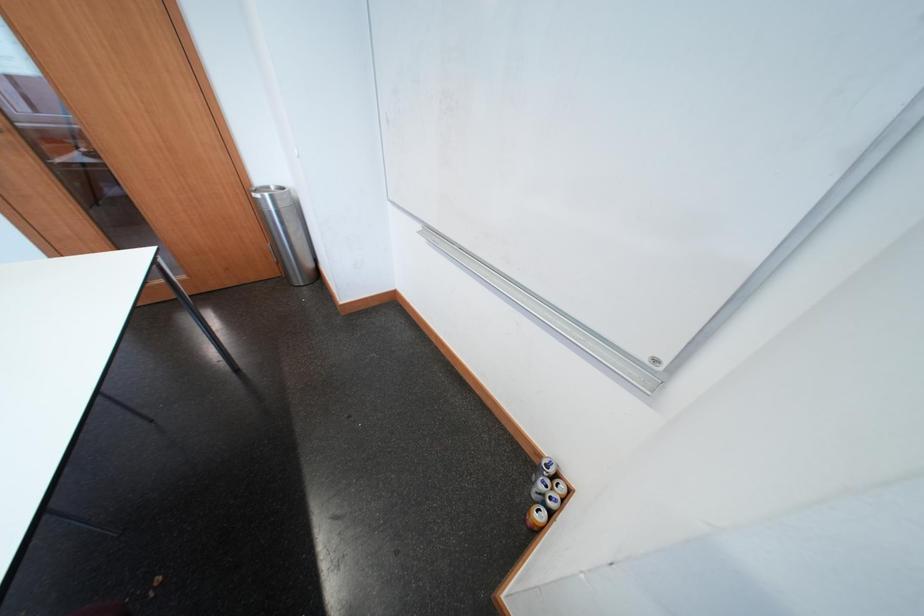
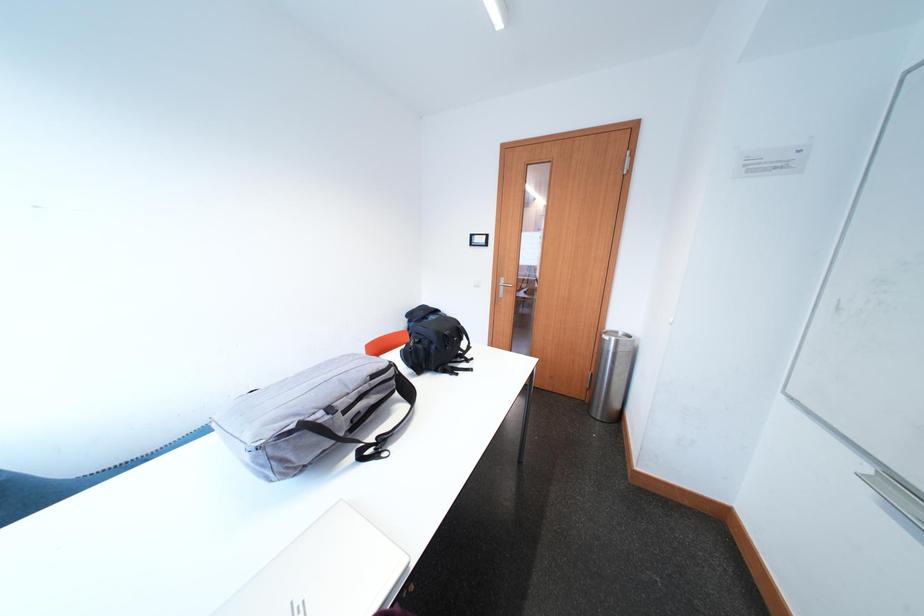
Question: How did the camera likely rotate?

Choices:
 (A) Left
 (B) Right
 (C) Up
 (D) Down

Answer: (A)